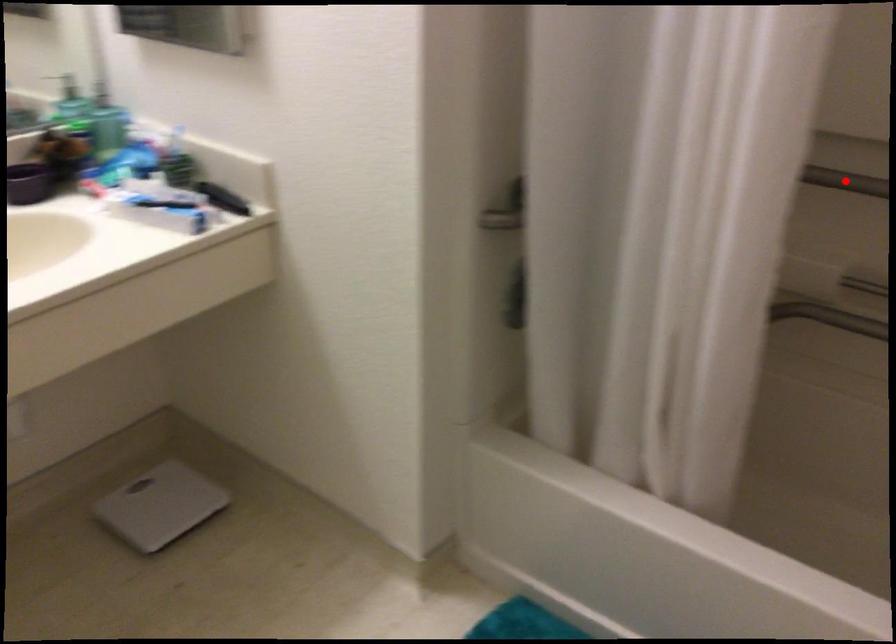
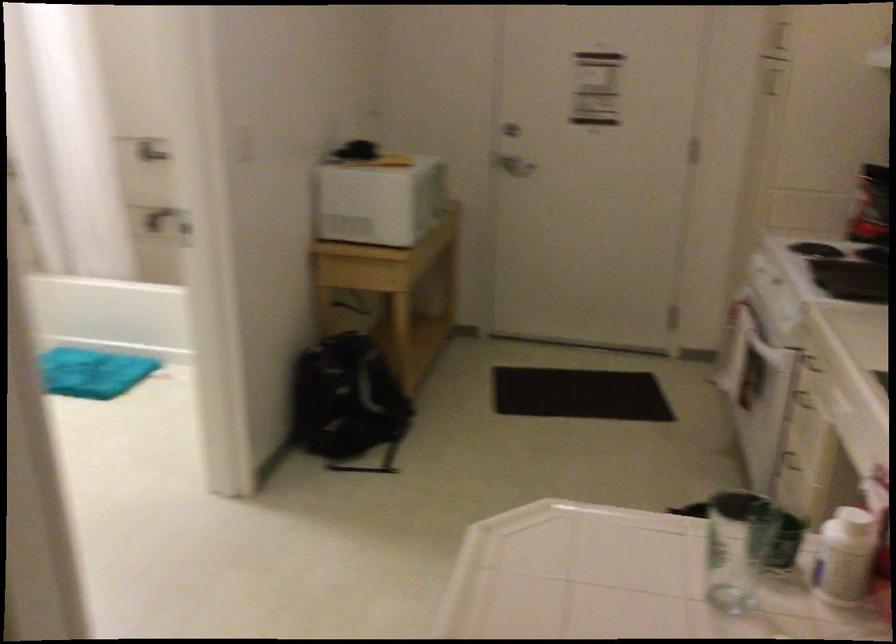
Question: I am providing you with two images of the same scene from different viewpoints. A red point is marked on the first image. Is the red point's position out of view in image 2?

Choices:
 (A) Yes
 (B) No

Answer: (A)